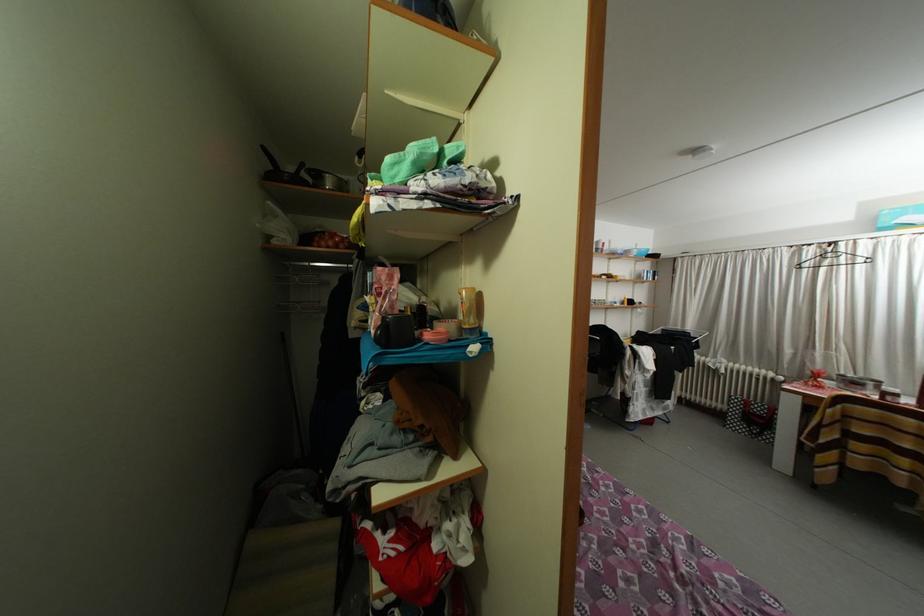
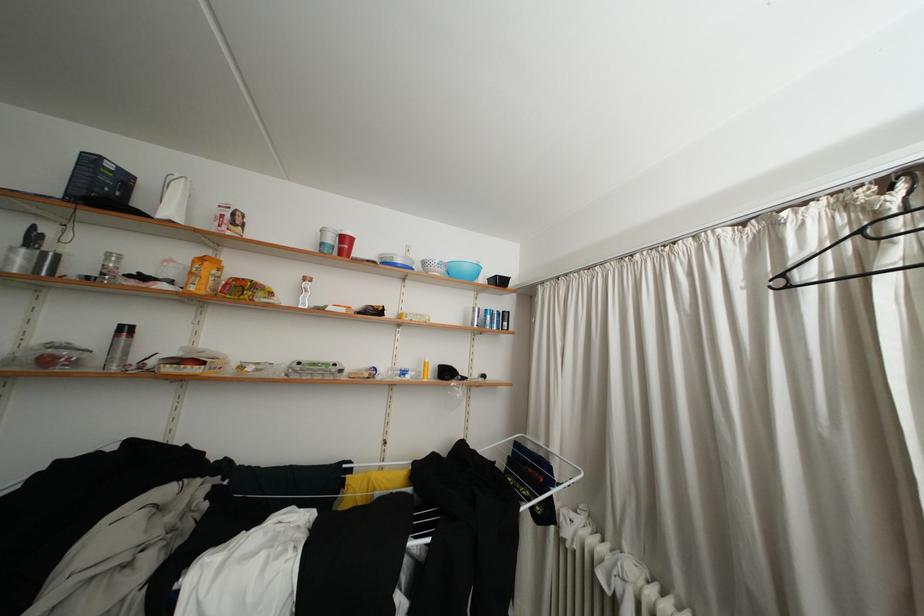
In the second image, find the point that corresponds to (609,252) in the first image.

(338, 245)